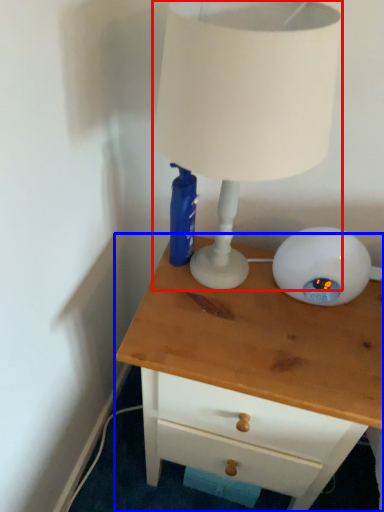
Question: Which object appears closest to the camera in this image, lamp (highlighted by a red box) or chest of drawers (highlighted by a blue box)?

Choices:
 (A) lamp
 (B) chest of drawers

Answer: (A)